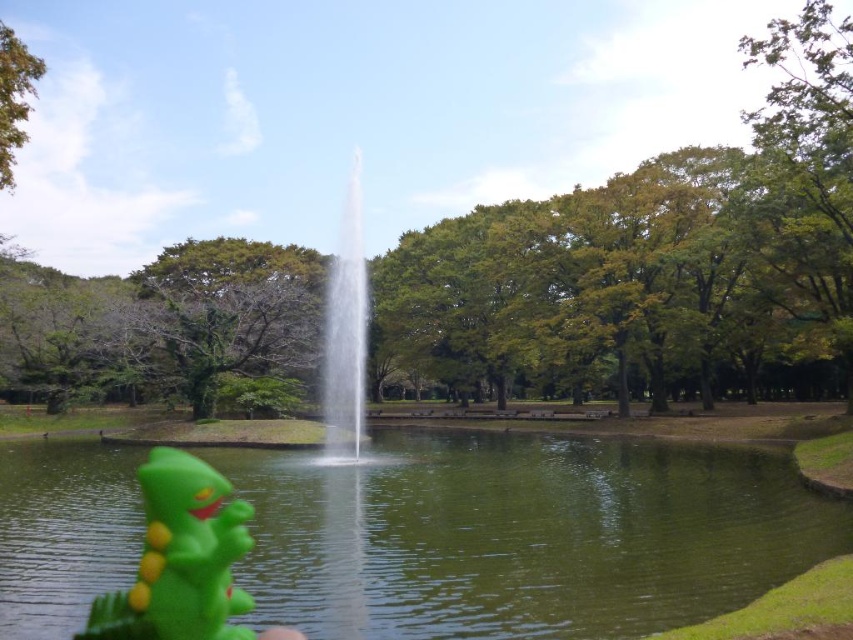
Question: Which of these objects is positioned farthest from the clear water fountain at center?

Choices:
 (A) green rubber toy at lower left
 (B) green rubber water at center

Answer: (A)

Question: Which of the following is the closest to the observer?

Choices:
 (A) green rubber toy at lower left
 (B) clear water fountain at center

Answer: (A)

Question: Can you confirm if green rubber water at center is positioned to the right of clear water fountain at center?

Choices:
 (A) no
 (B) yes

Answer: (B)

Question: Can you confirm if green rubber water at center is smaller than green rubber toy at lower left?

Choices:
 (A) yes
 (B) no

Answer: (A)

Question: Does green rubber toy at lower left have a greater width compared to clear water fountain at center?

Choices:
 (A) yes
 (B) no

Answer: (B)

Question: Which point is farther to the camera?

Choices:
 (A) (201, 522)
 (B) (344, 292)

Answer: (B)